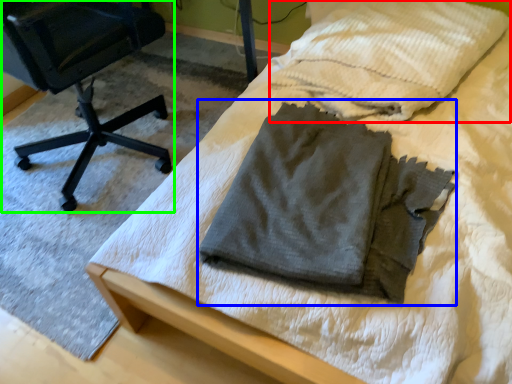
Question: Which object is positioned farthest from cloth (highlighted by a red box)? Select from laundry (highlighted by a blue box) and chair (highlighted by a green box).

Choices:
 (A) laundry
 (B) chair

Answer: (B)